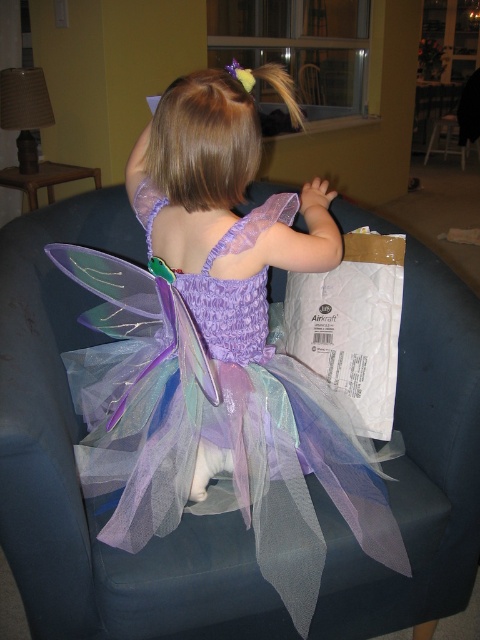
Question: Can you confirm if translucent tulle dress at center is positioned above white paper bag at right?

Choices:
 (A) no
 (B) yes

Answer: (B)

Question: Which object is farther from the camera taking this photo?

Choices:
 (A) translucent tulle dress at center
 (B) white paper bag at right

Answer: (B)

Question: Can you confirm if translucent tulle dress at center is positioned above white paper bag at right?

Choices:
 (A) yes
 (B) no

Answer: (A)

Question: Which of the following is the closest to the observer?

Choices:
 (A) (396, 236)
 (B) (168, 253)

Answer: (B)

Question: Is translucent tulle dress at center below white paper bag at right?

Choices:
 (A) yes
 (B) no

Answer: (B)